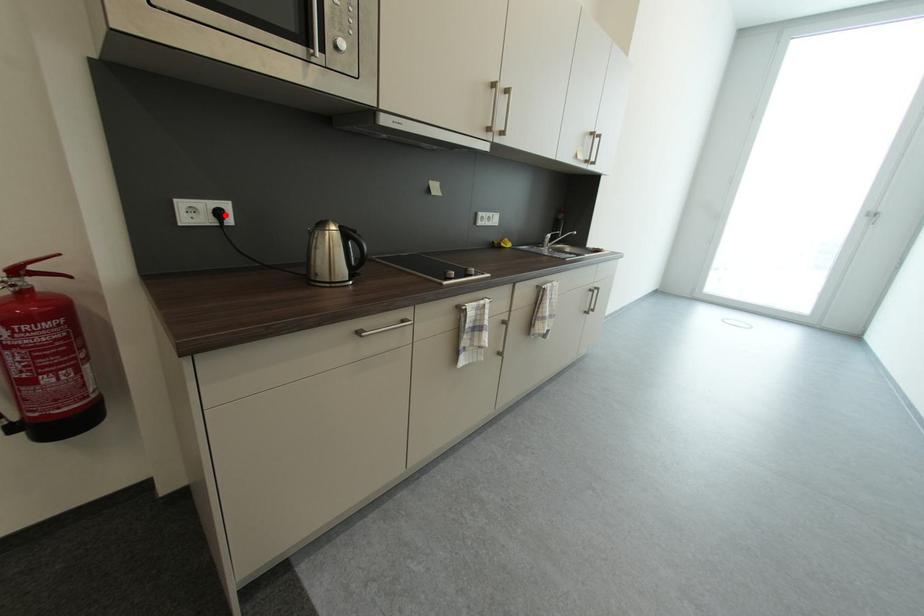
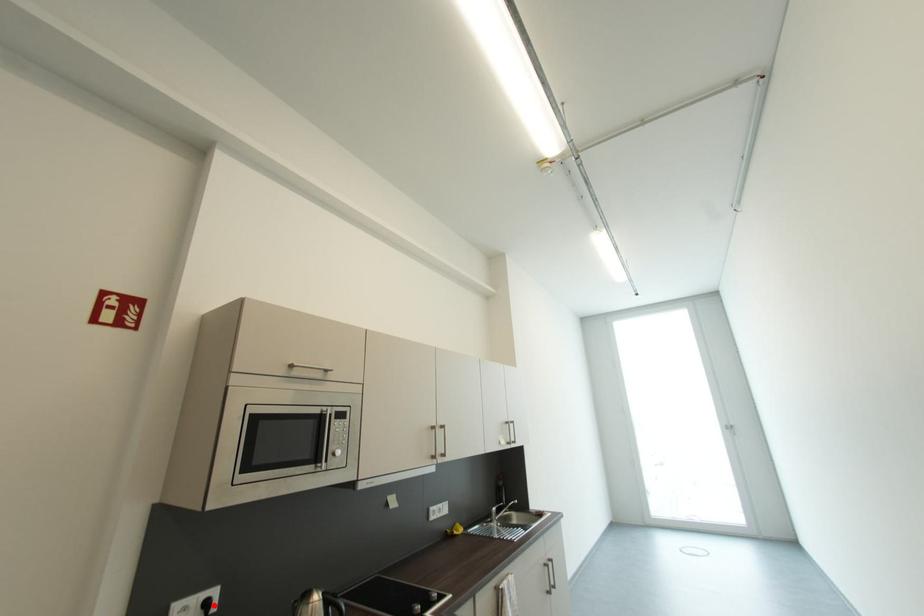
I am providing you with two images of the same scene from different viewpoints. A red point is marked on the first image and another point is marked on the second image. Is the red point in image1 aligned with the point shown in image2?

Yes